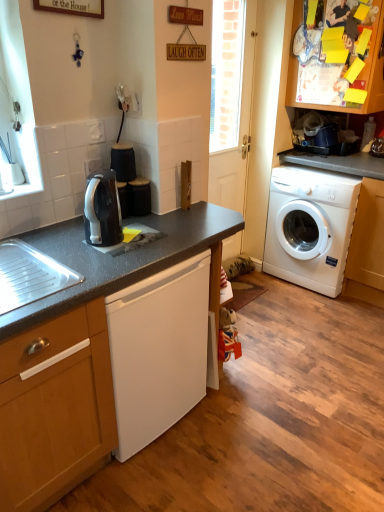
At what (x,y) coordinates should I click in order to perform the action: click on white glossy door at center. Please return your answer as a coordinate pair (x, y). The width and height of the screenshot is (384, 512). Looking at the image, I should click on (227, 180).

Identify the location of black glossy kettle at upper left. The height and width of the screenshot is (512, 384). (102, 210).

The width and height of the screenshot is (384, 512). What do you see at coordinates (81, 354) in the screenshot?
I see `black granite countertop at center` at bounding box center [81, 354].

Locate an element on the screen. Image resolution: width=384 pixels, height=512 pixels. black granite countertop at center is located at coordinates (81, 354).

You are a GUI agent. You are given a task and a screenshot of the screen. Output one action in this format:
    pyautogui.click(x=<x>, y=<y>)
    Task: Click on the wooden cabinet at lower left, the first cabinetry in the front-to-back sequence
    This screenshot has height=512, width=384.
    Given the screenshot: What is the action you would take?
    pyautogui.click(x=55, y=407)

Is wooden cabinet at lower left, which is the first cabinetry from left to right, spatially inside white glossy door at center, or outside of it?

wooden cabinet at lower left, which is the first cabinetry from left to right, is not inside white glossy door at center, it's outside.

Does wooden cabinet at lower left, which is the first cabinetry from left to right, have a greater height compared to white glossy door at center?

Incorrect, the height of wooden cabinet at lower left, which is the first cabinetry from left to right, is not larger of that of white glossy door at center.

From a real-world perspective, is wooden cabinet at lower left, positioned as the second cabinetry in right-to-left order, physically above white glossy door at center?

No, from a real-world perspective, wooden cabinet at lower left, positioned as the second cabinetry in right-to-left order, is not on top of white glossy door at center.

Is wooden cabinet at lower left, which is the first cabinetry from bottom to top, oriented away from white glossy door at center?

No.

Considering the positions of objects white glossy door at center and white plastic washing machine at right in the image provided, who is more to the left, white glossy door at center or white plastic washing machine at right?

From the viewer's perspective, white glossy door at center appears more on the left side.

Which object is more forward, white glossy door at center or white plastic washing machine at right?

white glossy door at center is closer to the camera.

Which is in front, point (247, 74) or point (293, 236)?

The point (247, 74) is more forward.

Which of these two, white glossy door at center or white plastic washing machine at right, stands taller?

white glossy door at center.

Based on their sizes in the image, would you say white plastic washing machine at right is bigger or smaller than yellow paper at upper right, arranged as the 1th cabinetry when viewed from the back?

In the image, white plastic washing machine at right appears to be smaller than yellow paper at upper right, arranged as the 1th cabinetry when viewed from the back.

From a real-world perspective, which object stands above the other?

yellow paper at upper right, which is the first cabinetry from top to bottom, is physically above.

Is yellow paper at upper right, positioned as the 1th cabinetry in right-to-left order, inside white plastic washing machine at right?

Actually, yellow paper at upper right, positioned as the 1th cabinetry in right-to-left order, is outside white plastic washing machine at right.

From the image's perspective, is white plastic washing machine at right over yellow paper at upper right, the second cabinetry positioned from the left?

Incorrect, from the image's perspective, white plastic washing machine at right is lower than yellow paper at upper right, the second cabinetry positioned from the left.

From the image's perspective, would you say yellow paper at upper right, the second cabinetry positioned from the left, is shown under black glossy kettle at upper left?

Incorrect, from the image's perspective, yellow paper at upper right, the second cabinetry positioned from the left, is higher than black glossy kettle at upper left.

Considering the sizes of objects yellow paper at upper right, positioned as the 1th cabinetry in right-to-left order, and black glossy kettle at upper left in the image provided, who is thinner, yellow paper at upper right, positioned as the 1th cabinetry in right-to-left order, or black glossy kettle at upper left?

black glossy kettle at upper left is thinner.

Is yellow paper at upper right, which is the first cabinetry from top to bottom, facing away from black glossy kettle at upper left?

No.

Considering the sizes of objects yellow paper at upper right, arranged as the second cabinetry when viewed from the front, and black glossy kettle at upper left in the image provided, who is smaller, yellow paper at upper right, arranged as the second cabinetry when viewed from the front, or black glossy kettle at upper left?

black glossy kettle at upper left is smaller.

In the scene shown: Which point is more forward, (51, 445) or (225, 202)?

Point (51, 445)

Is the surface of black granite countertop at center in direct contact with white glossy door at center?

They are not placed beside each other.

From the image's perspective, is black granite countertop at center located above or below white glossy door at center?

Based on their image positions, black granite countertop at center is located beneath white glossy door at center.

Can you tell me how much black granite countertop at center and white glossy door at center differ in facing direction?

0.347 degrees.

Which object is positioned more to the left, black granite countertop at center or white plastic washing machine at right?

From the viewer's perspective, black granite countertop at center appears more on the left side.

Is black granite countertop at center placed right next to white plastic washing machine at right?

black granite countertop at center and white plastic washing machine at right are clearly separated.

Can we say white glossy door at center lies outside black glossy kettle at upper left?

Absolutely, white glossy door at center is external to black glossy kettle at upper left.

Locate an element on the screen. This screenshot has width=384, height=512. kitchen appliance lying in front of the white glossy door at center is located at coordinates coord(102,210).

Does white glossy door at center have a lesser width compared to black glossy kettle at upper left?

Indeed, white glossy door at center has a lesser width compared to black glossy kettle at upper left.

Does white glossy door at center appear on the right side of black glossy kettle at upper left?

Correct, you'll find white glossy door at center to the right of black glossy kettle at upper left.

At what (x,y) coordinates should I click in order to perform the action: click on screen door behind the wooden cabinet at lower left, positioned as the second cabinetry in right-to-left order. Please return your answer as a coordinate pair (x, y). Image resolution: width=384 pixels, height=512 pixels. Looking at the image, I should click on (227, 180).

The height and width of the screenshot is (512, 384). Identify the location of screen door in front of the white plastic washing machine at right. (227, 180).

Considering their positions, is black glossy kettle at upper left positioned further to black granite countertop at center than yellow paper at upper right, arranged as the second cabinetry when viewed from the front?

yellow paper at upper right, arranged as the second cabinetry when viewed from the front, is positioned further to the anchor black granite countertop at center.

Considering their positions, is black glossy kettle at upper left positioned further to white plastic washing machine at right than white glossy door at center?

Among the two, black glossy kettle at upper left is located further to white plastic washing machine at right.

Estimate the real-world distances between objects in this image. Which object is further from white glossy door at center, wooden cabinet at lower left, which is the first cabinetry from bottom to top, or white plastic washing machine at right?

wooden cabinet at lower left, which is the first cabinetry from bottom to top, is positioned further to the anchor white glossy door at center.

Which object lies nearer to the anchor point yellow paper at upper right, arranged as the 1th cabinetry when viewed from the back, black granite countertop at center or white glossy door at center?

Based on the image, white glossy door at center appears to be nearer to yellow paper at upper right, arranged as the 1th cabinetry when viewed from the back.

Looking at the image, which one is located closer to black glossy kettle at upper left, yellow paper at upper right, positioned as the 1th cabinetry in right-to-left order, or wooden cabinet at lower left, marked as the 2th cabinetry in a back-to-front arrangement?

The object closer to black glossy kettle at upper left is wooden cabinet at lower left, marked as the 2th cabinetry in a back-to-front arrangement.

Looking at the image, which one is located further to wooden cabinet at lower left, which is the second cabinetry from top to bottom, yellow paper at upper right, arranged as the second cabinetry when viewed from the front, or black granite countertop at center?

Based on the image, yellow paper at upper right, arranged as the second cabinetry when viewed from the front, appears to be further to wooden cabinet at lower left, which is the second cabinetry from top to bottom.

Which object lies nearer to the anchor point white glossy door at center, black glossy kettle at upper left or wooden cabinet at lower left, which is the first cabinetry from bottom to top?

Among the two, black glossy kettle at upper left is located nearer to white glossy door at center.

When comparing their distances from black glossy kettle at upper left, does white plastic washing machine at right or black granite countertop at center seem closer?

Among the two, black granite countertop at center is located nearer to black glossy kettle at upper left.

At what (x,y) coordinates should I click in order to perform the action: click on screen door that lies between yellow paper at upper right, positioned as the 1th cabinetry in right-to-left order, and white plastic washing machine at right from top to bottom. Please return your answer as a coordinate pair (x, y). This screenshot has height=512, width=384. Looking at the image, I should click on (227, 180).

I want to click on countertop between black glossy kettle at upper left and wooden cabinet at lower left, which is the first cabinetry from bottom to top, in the vertical direction, so click(x=81, y=354).

Find the location of a particular element. This screenshot has height=512, width=384. screen door positioned between wooden cabinet at lower left, which is the first cabinetry from left to right, and white plastic washing machine at right from near to far is located at coordinates (227, 180).

The image size is (384, 512). Find the location of `countertop between wooden cabinet at lower left, the first cabinetry in the front-to-back sequence, and white plastic washing machine at right, along the z-axis`. countertop between wooden cabinet at lower left, the first cabinetry in the front-to-back sequence, and white plastic washing machine at right, along the z-axis is located at coordinates (81, 354).